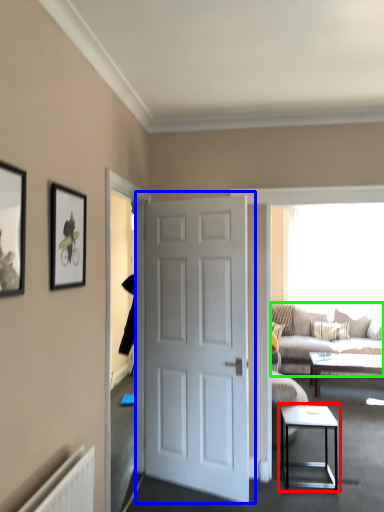
Question: Considering the real-world distances, which object is farthest from table (highlighted by a red box)? door (highlighted by a blue box) or studio couch (highlighted by a green box)?

Choices:
 (A) door
 (B) studio couch

Answer: (B)